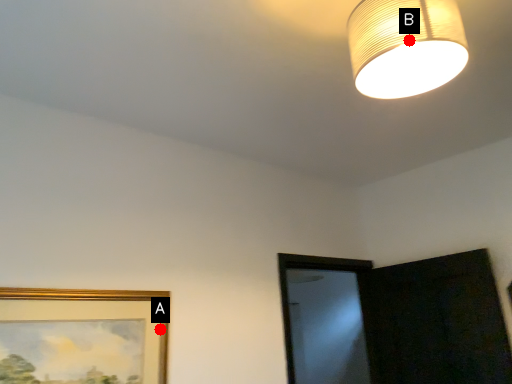
Question: Two points are circled on the image, labeled by A and B beside each circle. Among these points, which one is farthest from the camera?

Choices:
 (A) A is further
 (B) B is further

Answer: (A)